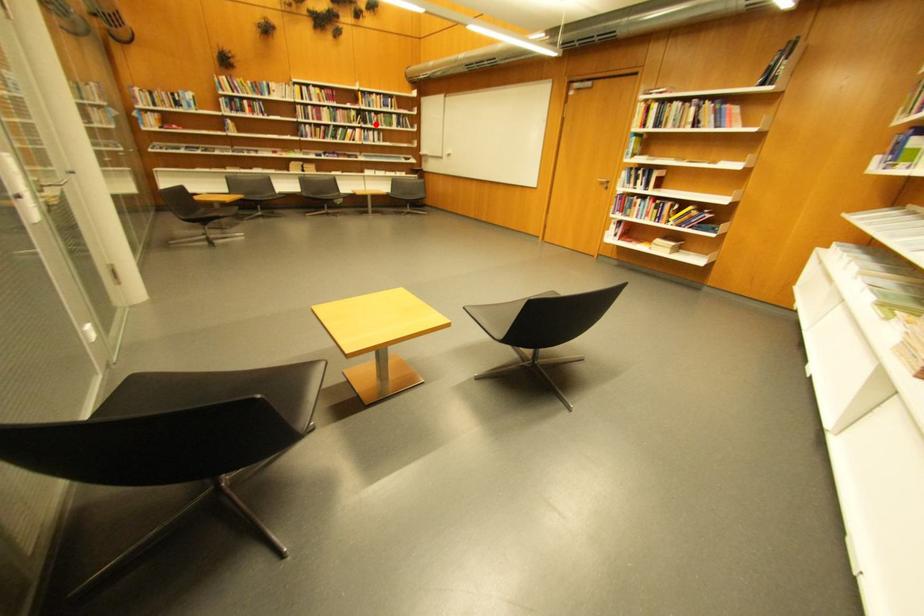
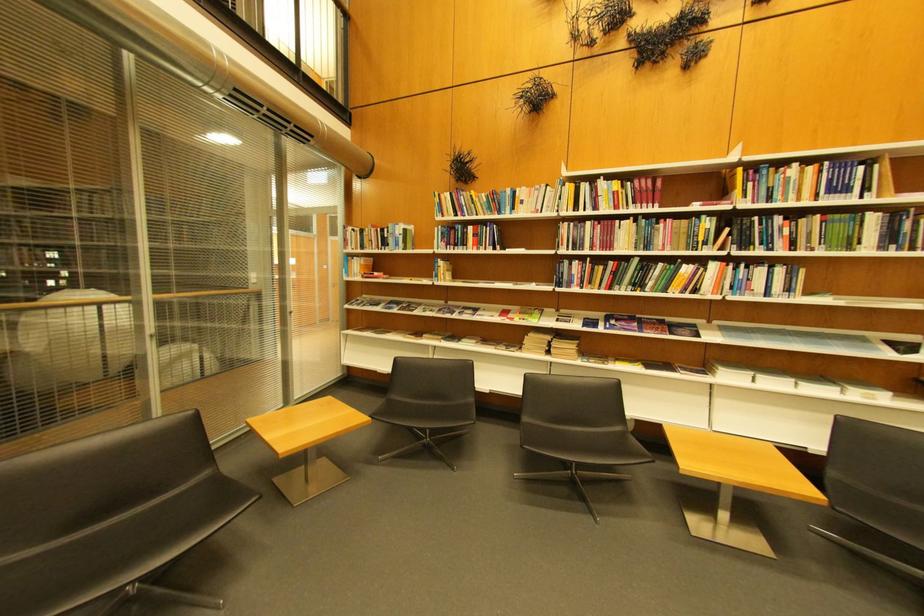
Where in the second image is the point corresponding to the highlighted location from the first image?

(756, 246)